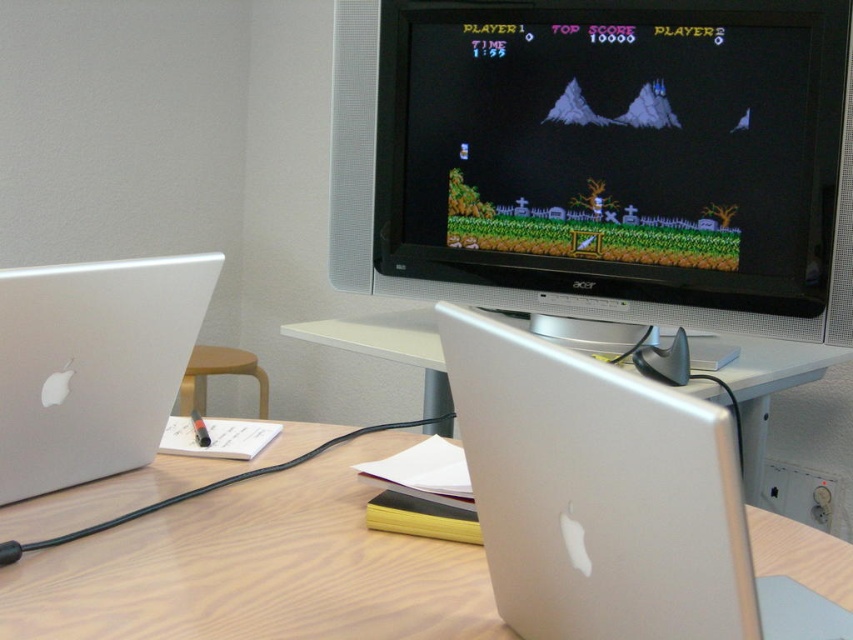
Question: Does silver metallic laptop at center have a lesser width compared to silver metallic computer desk at center?

Choices:
 (A) yes
 (B) no

Answer: (A)

Question: Which of the following is the farthest from the observer?

Choices:
 (A) (21, 490)
 (B) (850, 241)
 (C) (314, 600)

Answer: (B)

Question: Which point is closer to the camera?

Choices:
 (A) (415, 310)
 (B) (120, 397)
 (C) (541, 531)

Answer: (C)

Question: Does silver metallic computer desk at lower center have a greater width compared to silver metallic computer desk at center?

Choices:
 (A) yes
 (B) no

Answer: (A)

Question: Can you confirm if silver metallic laptop at left is positioned to the left of silver metallic computer desk at center?

Choices:
 (A) yes
 (B) no

Answer: (A)

Question: Considering the real-world distances, which object is closest to the silver metallic computer desk at lower center?

Choices:
 (A) black plastic monitor at upper center
 (B) silver metallic computer desk at center
 (C) silver metallic laptop at left
 (D) silver metallic laptop at center

Answer: (C)